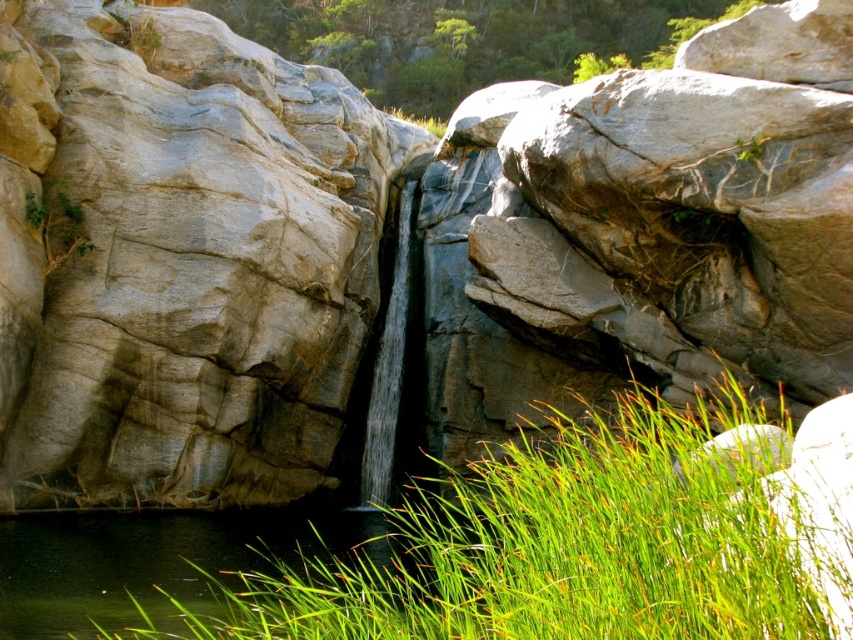
Between green grass at center and green grassy water at lower left, which one has less height?

Standing shorter between the two is green grassy water at lower left.

Is green grass at center to the left of green grassy water at lower left from the viewer's perspective?

Incorrect, green grass at center is not on the left side of green grassy water at lower left.

Find the location of a particular element. This screenshot has width=853, height=640. green grass at center is located at coordinates (581, 541).

This screenshot has width=853, height=640. I want to click on green grass at center, so click(x=581, y=541).

Based on the photo, how far apart are green grassy water at lower left and clear water at center?

green grassy water at lower left and clear water at center are 8.86 meters apart from each other.

Which of these two, green grassy water at lower left or clear water at center, stands taller?

Standing taller between the two is clear water at center.

Is point (105, 609) in front of point (392, 372)?

Yes.

This screenshot has height=640, width=853. I want to click on green grassy water at lower left, so click(154, 563).

Between green grass at center and clear water at center, which one has less height?

With less height is green grass at center.

Between green grass at center and clear water at center, which one is positioned higher?

clear water at center

The height and width of the screenshot is (640, 853). Describe the element at coordinates (581, 541) in the screenshot. I see `green grass at center` at that location.

You are a GUI agent. You are given a task and a screenshot of the screen. Output one action in this format:
    pyautogui.click(x=<x>, y=<y>)
    Task: Click on the green grass at center
    This screenshot has width=853, height=640.
    Given the screenshot: What is the action you would take?
    581,541